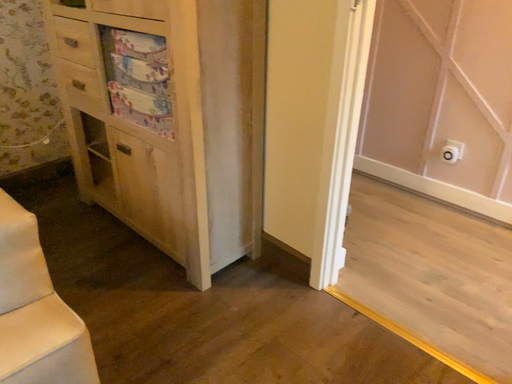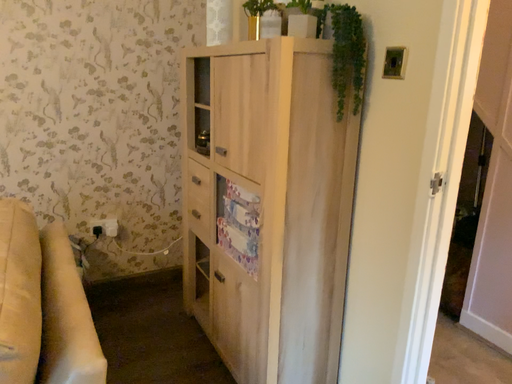
Question: How did the camera likely rotate when shooting the video?

Choices:
 (A) rotated right
 (B) rotated left

Answer: (B)